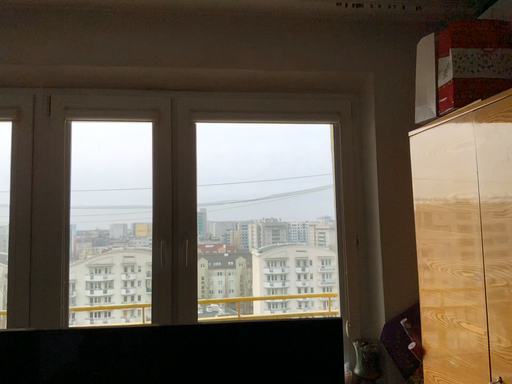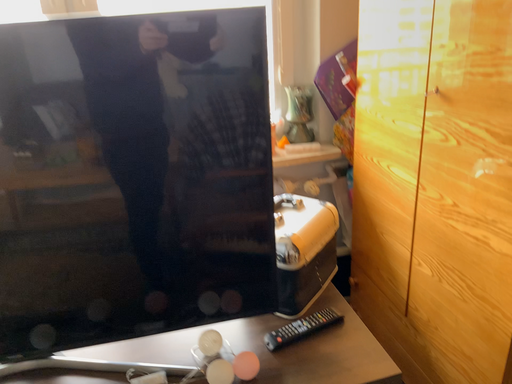
Question: How did the camera likely rotate when shooting the video?

Choices:
 (A) rotated left
 (B) rotated right

Answer: (B)